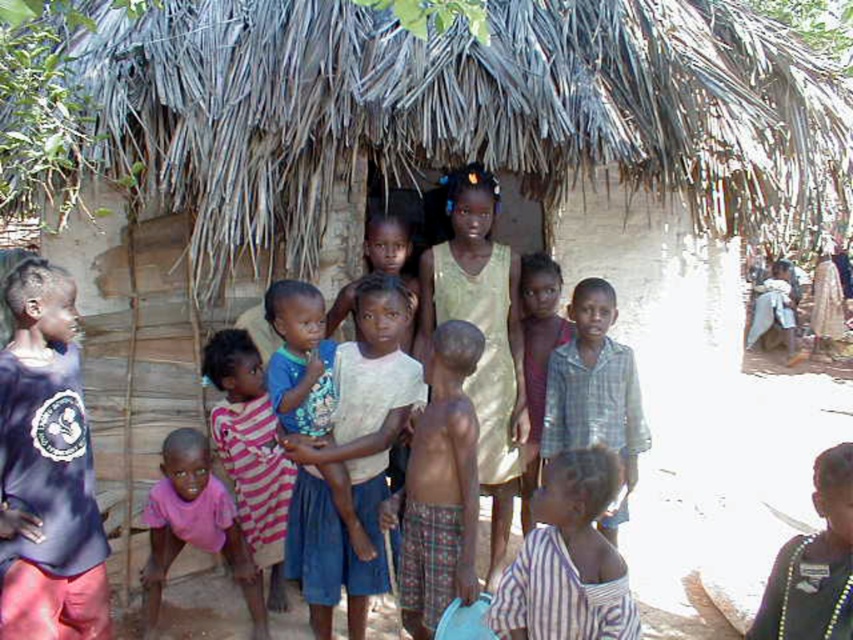
You are standing in front of the thatched roof hut and see two points marked in the scene. Which point is closer to you, point (445,442) or point (550,296)?

Point (445,442) is in front of point (550,296), so it is closer to you.

You are a photographer standing at the camera position. You want to take a closeup photo of the plaid fabric shirt at center. Can you reach it with your camera lens without moving closer? The camera has a maximum zoom range of 3 meters.

The plaid fabric shirt at center is 4.54 meters away from the camera. Since the camera can only zoom up to 3 meters, you cannot take a closeup without moving closer.